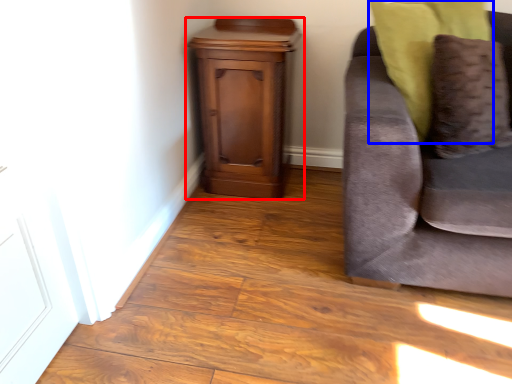
Question: Which object is closer to the camera taking this photo, nightstand (highlighted by a red box) or pillow (highlighted by a blue box)?

Choices:
 (A) nightstand
 (B) pillow

Answer: (B)